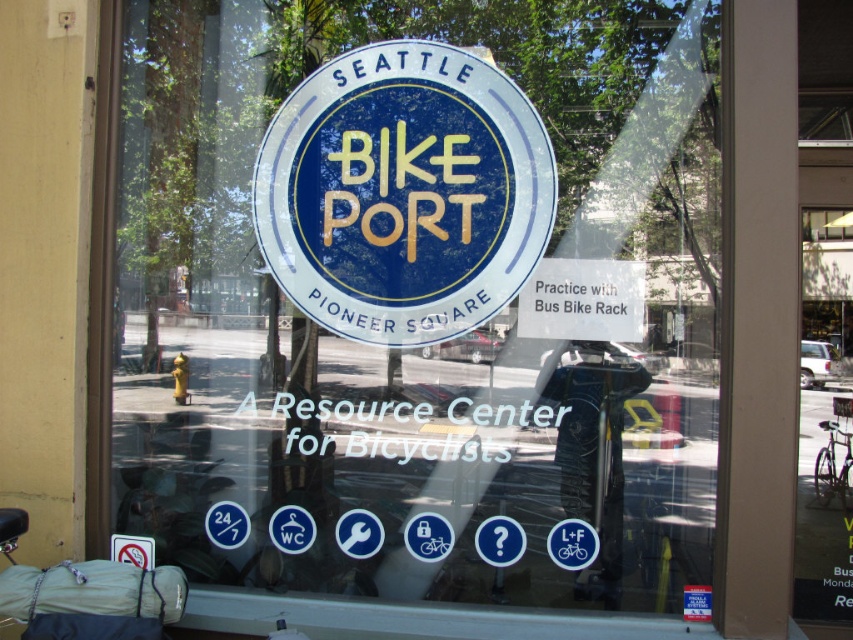
Question: Which point appears farthest from the camera in this image?

Choices:
 (A) (560, 316)
 (B) (376, 200)

Answer: (B)

Question: Where is blue matte sign at center located in relation to white paper sign at center in the image?

Choices:
 (A) left
 (B) right

Answer: (A)

Question: Is blue matte sign at center behind white paper sign at center?

Choices:
 (A) yes
 (B) no

Answer: (A)

Question: Which object appears closest to the camera in this image?

Choices:
 (A) white paper sign at center
 (B) blue matte sign at center

Answer: (A)

Question: Where is blue matte sign at center located in relation to white paper sign at center in the image?

Choices:
 (A) below
 (B) above

Answer: (B)